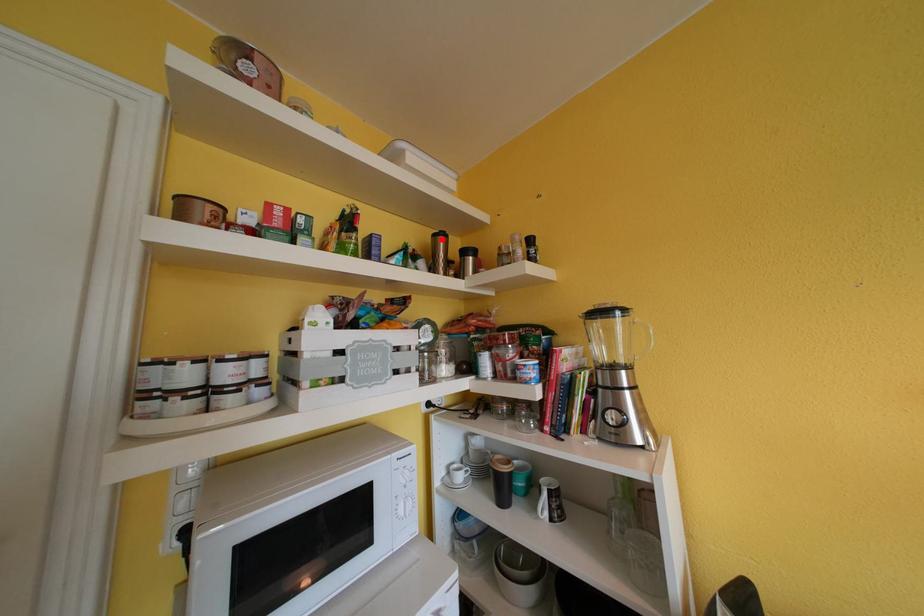
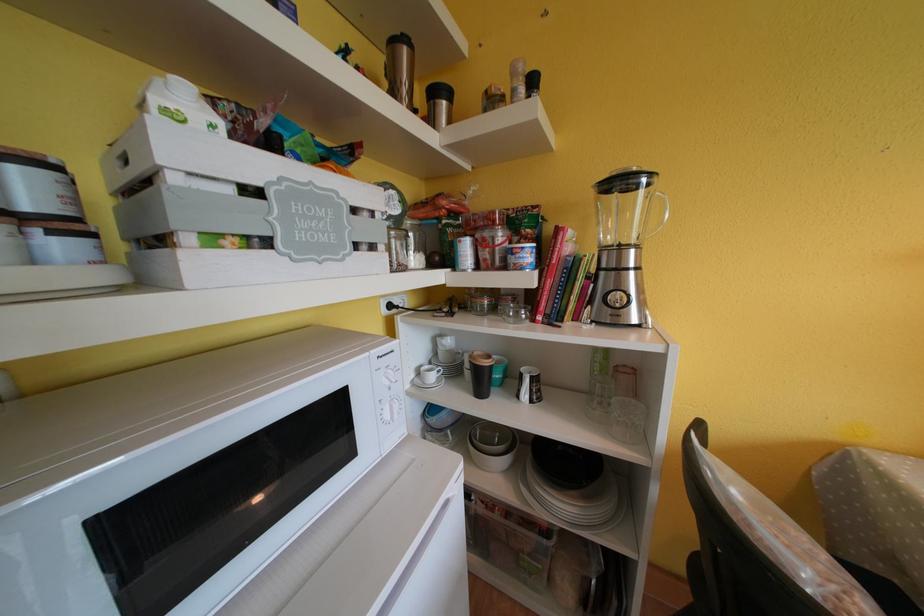
Locate, in the second image, the point that corresponds to the highlighted location in the first image.

(399, 46)